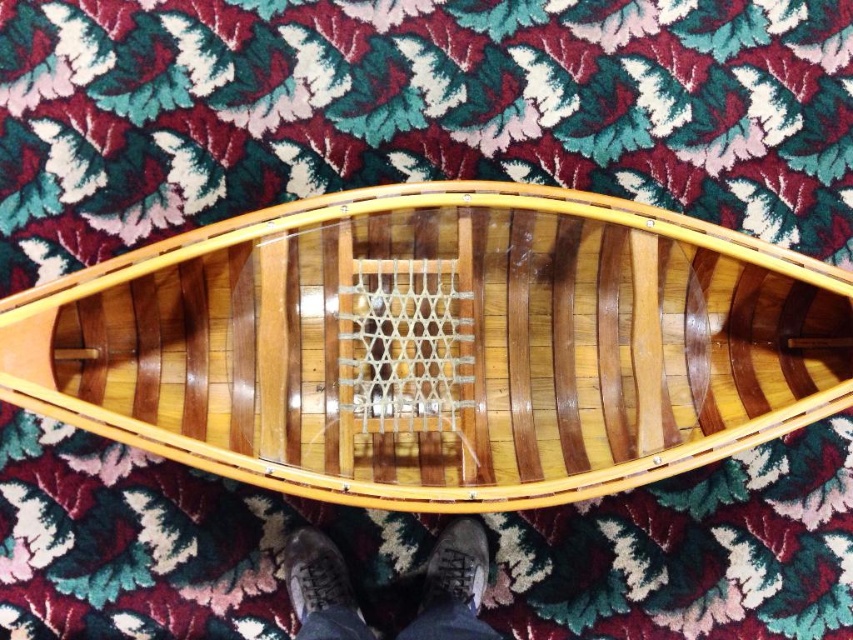
Question: Estimate the real-world distances between objects in this image. Which object is farther from the leather textured shoe at lower center?

Choices:
 (A) wooden boat at center
 (B) brown leather shoes at lower center
 (C) brown leather shoe at lower center

Answer: (A)

Question: Which point is farther to the camera?

Choices:
 (A) brown leather shoes at lower center
 (B) leather textured shoe at lower center
 (C) brown leather shoe at lower center
 (D) wooden boat at center

Answer: (C)

Question: Which of the following is the farthest from the observer?

Choices:
 (A) (399, 298)
 (B) (440, 560)
 (C) (335, 602)

Answer: (B)

Question: Is wooden boat at center positioned behind brown leather shoes at lower center?

Choices:
 (A) no
 (B) yes

Answer: (A)

Question: Is wooden boat at center to the left of brown leather shoes at lower center from the viewer's perspective?

Choices:
 (A) no
 (B) yes

Answer: (A)

Question: Can you confirm if brown leather shoes at lower center is positioned below leather textured shoe at lower center?

Choices:
 (A) yes
 (B) no

Answer: (A)